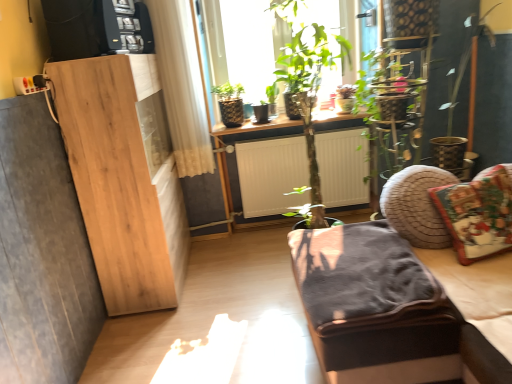
Where is `velvet dark gray studio couch at lower right`? The width and height of the screenshot is (512, 384). velvet dark gray studio couch at lower right is located at coordinates (394, 307).

The height and width of the screenshot is (384, 512). Describe the element at coordinates (394, 307) in the screenshot. I see `velvet dark gray studio couch at lower right` at that location.

Measure the distance between point (353, 322) and camera.

Point (353, 322) and camera are 4.79 feet apart from each other.

Locate an element on the screen. This screenshot has height=384, width=512. christmas-patterned fabric pillow at right is located at coordinates (478, 214).

What do you see at coordinates (478, 214) in the screenshot?
I see `christmas-patterned fabric pillow at right` at bounding box center [478, 214].

Identify the location of velvet dark gray studio couch at lower right. (394, 307).

Considering the relative positions of christmas-patterned fabric pillow at right and velvet dark gray studio couch at lower right in the image provided, is christmas-patterned fabric pillow at right to the left of velvet dark gray studio couch at lower right from the viewer's perspective?

No.

In the scene shown: Between christmas-patterned fabric pillow at right and velvet dark gray studio couch at lower right, which one is positioned in front?

velvet dark gray studio couch at lower right is closer to the camera.

Consider the image. Which is nearer, (x=489, y=184) or (x=480, y=311)?

Point (x=489, y=184).

From the image's perspective, would you say christmas-patterned fabric pillow at right is positioned over velvet dark gray studio couch at lower right?

Indeed, from the image's perspective, christmas-patterned fabric pillow at right is shown above velvet dark gray studio couch at lower right.

Consider the image. From a real-world perspective, which is physically above, christmas-patterned fabric pillow at right or velvet dark gray studio couch at lower right?

From a 3D spatial view, christmas-patterned fabric pillow at right is above.

Which object is thinner, christmas-patterned fabric pillow at right or velvet dark gray studio couch at lower right?

christmas-patterned fabric pillow at right.

Considering the relative sizes of christmas-patterned fabric pillow at right and velvet dark gray studio couch at lower right in the image provided, is christmas-patterned fabric pillow at right shorter than velvet dark gray studio couch at lower right?

Correct, christmas-patterned fabric pillow at right is not as tall as velvet dark gray studio couch at lower right.

Considering the sizes of objects christmas-patterned fabric pillow at right and velvet dark gray studio couch at lower right in the image provided, who is smaller, christmas-patterned fabric pillow at right or velvet dark gray studio couch at lower right?

Smaller between the two is christmas-patterned fabric pillow at right.

Is velvet dark gray studio couch at lower right located within christmas-patterned fabric pillow at right?

Definitely not — velvet dark gray studio couch at lower right is not inside christmas-patterned fabric pillow at right.

Would you consider christmas-patterned fabric pillow at right to be distant from velvet dark gray studio couch at lower right?

christmas-patterned fabric pillow at right is near velvet dark gray studio couch at lower right, not far away.

In the scene shown: Is christmas-patterned fabric pillow at right aimed at velvet dark gray studio couch at lower right?

Yes, christmas-patterned fabric pillow at right faces towards velvet dark gray studio couch at lower right.

How many degrees apart are the facing directions of christmas-patterned fabric pillow at right and velvet dark gray studio couch at lower right?

2.51 degrees separate the facing orientations of christmas-patterned fabric pillow at right and velvet dark gray studio couch at lower right.

This screenshot has height=384, width=512. In order to click on pillow on the right of velvet dark gray studio couch at lower right in this screenshot , I will do `click(478, 214)`.

Consider the image. Is velvet dark gray studio couch at lower right at the right side of christmas-patterned fabric pillow at right?

No, velvet dark gray studio couch at lower right is not to the right of christmas-patterned fabric pillow at right.

Is velvet dark gray studio couch at lower right in front of or behind christmas-patterned fabric pillow at right in the image?

In the image, velvet dark gray studio couch at lower right appears in front of christmas-patterned fabric pillow at right.

Which is closer, (346, 351) or (473, 239)?

Point (346, 351)

From the image's perspective, which one is positioned higher, velvet dark gray studio couch at lower right or christmas-patterned fabric pillow at right?

christmas-patterned fabric pillow at right, from the image's perspective.

From a real-world perspective, relative to christmas-patterned fabric pillow at right, is velvet dark gray studio couch at lower right vertically above or below?

velvet dark gray studio couch at lower right is below christmas-patterned fabric pillow at right.

In terms of width, does velvet dark gray studio couch at lower right look wider or thinner when compared to christmas-patterned fabric pillow at right?

Clearly, velvet dark gray studio couch at lower right has more width compared to christmas-patterned fabric pillow at right.

Who is shorter, velvet dark gray studio couch at lower right or christmas-patterned fabric pillow at right?

christmas-patterned fabric pillow at right.

Is velvet dark gray studio couch at lower right bigger than christmas-patterned fabric pillow at right?

Yes.

Is velvet dark gray studio couch at lower right completely or partially outside of christmas-patterned fabric pillow at right?

Yes, velvet dark gray studio couch at lower right is not within christmas-patterned fabric pillow at right.

Is velvet dark gray studio couch at lower right touching christmas-patterned fabric pillow at right?

No, velvet dark gray studio couch at lower right is not making contact with christmas-patterned fabric pillow at right.

Is velvet dark gray studio couch at lower right oriented towards christmas-patterned fabric pillow at right?

Yes, velvet dark gray studio couch at lower right faces towards christmas-patterned fabric pillow at right.

Can you tell me how much velvet dark gray studio couch at lower right and christmas-patterned fabric pillow at right differ in facing direction?

There is a 2.51-degree angle between the facing directions of velvet dark gray studio couch at lower right and christmas-patterned fabric pillow at right.

Consider the image. How far apart are velvet dark gray studio couch at lower right and christmas-patterned fabric pillow at right?

A distance of 12.16 inches exists between velvet dark gray studio couch at lower right and christmas-patterned fabric pillow at right.

The width and height of the screenshot is (512, 384). What are the coordinates of `studio couch in front of the christmas-patterned fabric pillow at right` in the screenshot? It's located at (394, 307).

Locate an element on the screen. This screenshot has width=512, height=384. pillow above the velvet dark gray studio couch at lower right (from the image's perspective) is located at coordinates 478,214.

You are a GUI agent. You are given a task and a screenshot of the screen. Output one action in this format:
    pyautogui.click(x=<x>, y=<y>)
    Task: Click on the studio couch in front of the christmas-patterned fabric pillow at right
    The height and width of the screenshot is (384, 512).
    Given the screenshot: What is the action you would take?
    pyautogui.click(x=394, y=307)